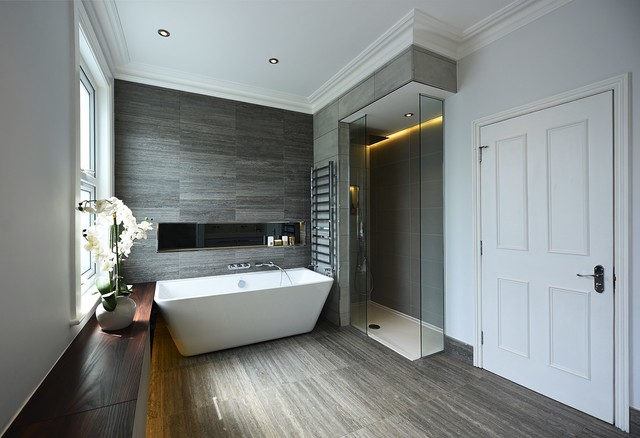
Locate an element on the screen. The height and width of the screenshot is (438, 640). shower drain is located at coordinates (374, 327).